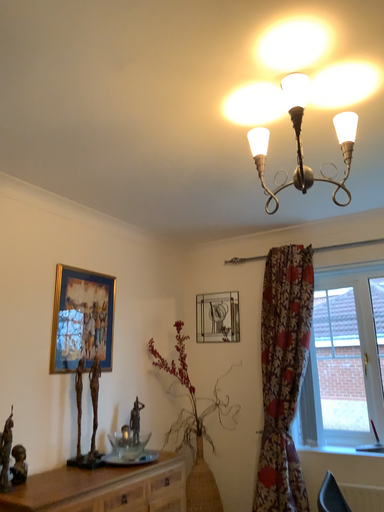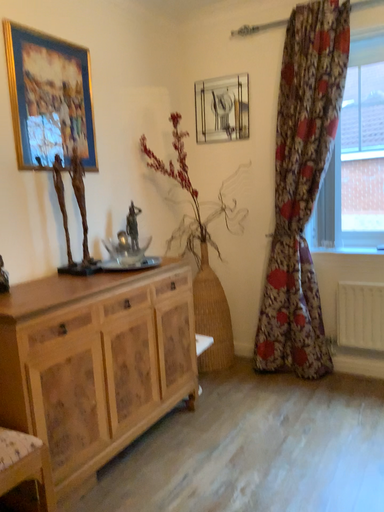
Question: How did the camera likely rotate when shooting the video?

Choices:
 (A) rotated upward
 (B) rotated downward

Answer: (B)